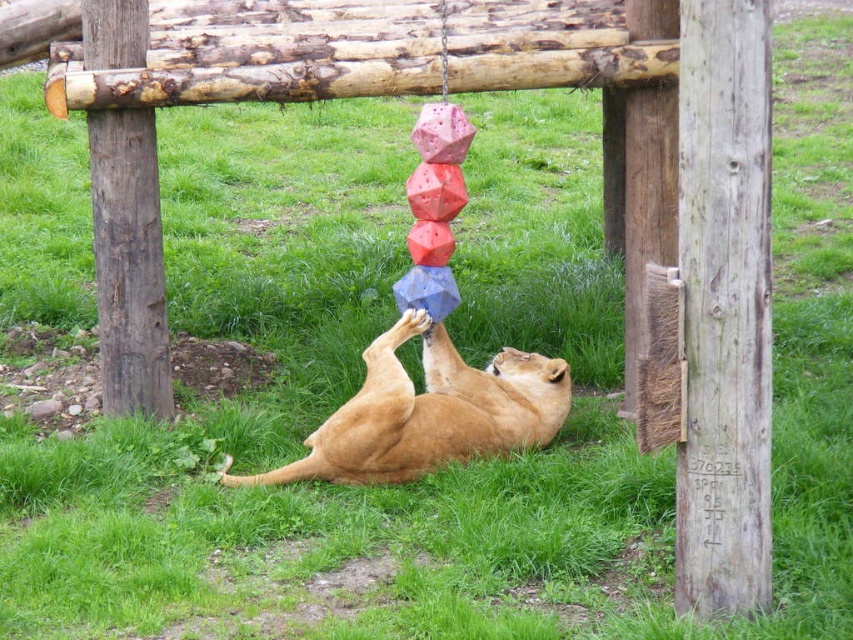
You are a zookeeper observing the lion enclosure. You need to ensure the golden fur lion at center can safely reach the hanging toy. Considering the height of the weathered wood pole at right, which is taller than the lion, is the toy within the lioness reach?

The weathered wood pole at right is taller than the golden fur lion at center, but the toy is suspended from the pole. Since the pole is taller, the toy might be positioned at a height that the lioness cannot reach. However, the exact reach capability of the lioness isn

You are a zookeeper who needs to clean the area around the golden fur lion at center and the brown rough wood pole at left. The cleaning equipment is 1 meter wide. Can you maneuver the equipment between them without moving either object?

The distance between the golden fur lion at center and the brown rough wood pole at left is 1.25 meters. Since the equipment is 1 meter wide, there is enough space to maneuver between them without moving either object.